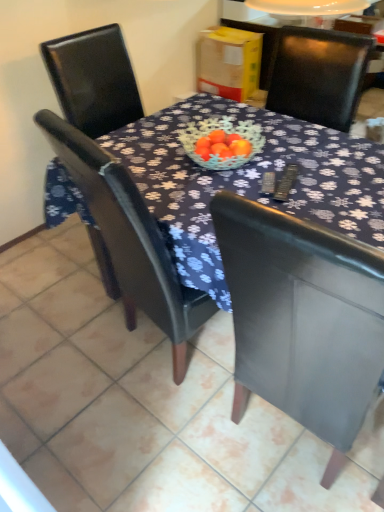
Where is `vacant space to the left of matte black chair at center, the first chair from the right`? vacant space to the left of matte black chair at center, the first chair from the right is located at coordinates (147, 450).